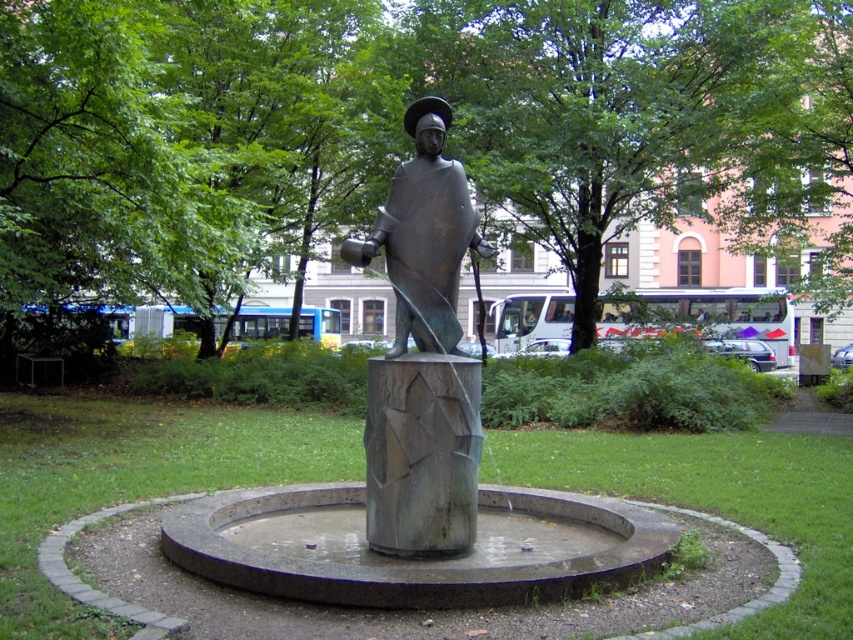
Question: Can you confirm if green leafy tree at center is positioned below bronze statue at center?

Choices:
 (A) no
 (B) yes

Answer: (A)

Question: Can you confirm if green leafy tree at center is positioned below bronze statue at center?

Choices:
 (A) no
 (B) yes

Answer: (A)

Question: Is green leafy tree at center wider than bronze statue at center?

Choices:
 (A) no
 (B) yes

Answer: (B)